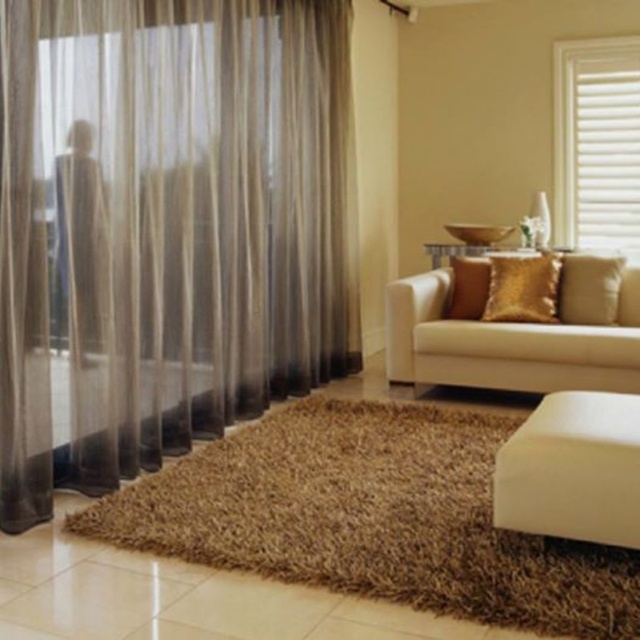
Question: From the image, what is the correct spatial relationship of white matte ottoman at lower right in relation to gold textured pillow at right?

Choices:
 (A) right
 (B) left

Answer: (B)

Question: Is beige fabric couch at center wider than gold textured pillow at center?

Choices:
 (A) no
 (B) yes

Answer: (B)

Question: Among these points, which one is nearest to the camera?

Choices:
 (A) (611, 131)
 (B) (484, 259)

Answer: (B)

Question: Which point is closer to the camera taking this photo?

Choices:
 (A) (499, 292)
 (B) (49, 88)

Answer: (B)

Question: Does gold shiny pillow at center appear on the right side of gold textured pillow at right?

Choices:
 (A) yes
 (B) no

Answer: (B)

Question: Which of the following is the closest to the observer?

Choices:
 (A) beige fabric couch at center
 (B) white matte blinds at upper right

Answer: (A)